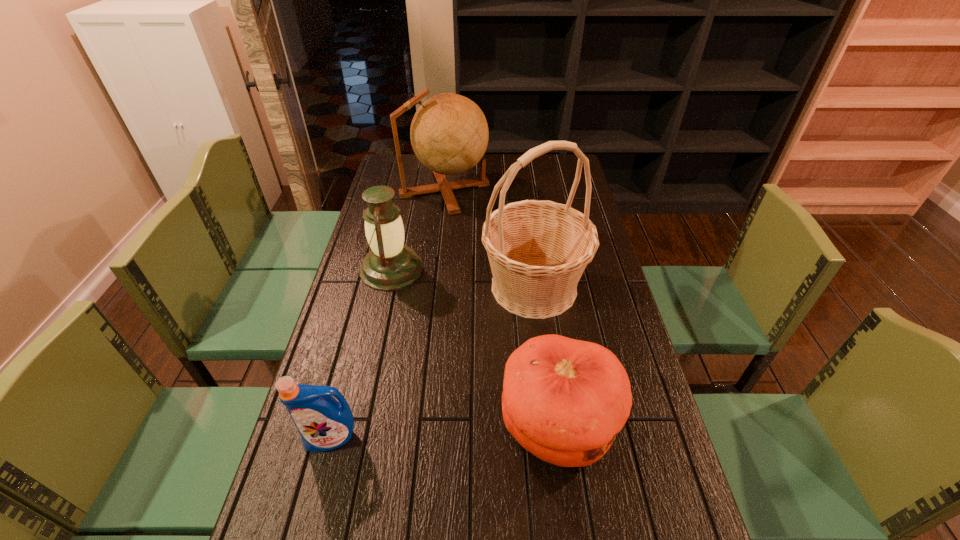
This screenshot has width=960, height=540. In the image, there is a desktop. In order to click on vacant space at the right edge in this screenshot , I will do `click(629, 330)`.

At what (x,y) coordinates should I click in order to perform the action: click on blank area at the far left corner. Please return your answer as a coordinate pair (x, y). This screenshot has width=960, height=540. Looking at the image, I should click on (411, 176).

This screenshot has width=960, height=540. I want to click on vacant point located between the third shortest object and the tallest object, so click(x=463, y=278).

Where is `vacant point located between the third shortest object and the fourth shortest object`? The height and width of the screenshot is (540, 960). vacant point located between the third shortest object and the fourth shortest object is located at coordinates (418, 230).

Locate an element on the screen. free space between the lantern and the detergent is located at coordinates (362, 354).

Locate an element on the screen. This screenshot has height=540, width=960. free space between the third tallest object and the pumpkin is located at coordinates (474, 347).

Where is `vacant space in between the detergent and the farthest object`? vacant space in between the detergent and the farthest object is located at coordinates (388, 314).

You are a GUI agent. You are given a task and a screenshot of the screen. Output one action in this format:
    pyautogui.click(x=<x>, y=<y>)
    Task: Click on the object that is the third closest to the globe
    The width and height of the screenshot is (960, 540).
    Given the screenshot: What is the action you would take?
    pyautogui.click(x=564, y=400)

Select which object appears as the second closest to the basket. Please provide its 2D coordinates. Your answer should be formatted as a tuple, i.e. [(x, y)], where the tuple contains the x and y coordinates of a point satisfying the conditions above.

[(390, 265)]

Find the location of a particular element. free space that satisfies the following two spatial constraints: 1. on the back side of the tallest object; 2. on the surface of the farthest object is located at coordinates (521, 190).